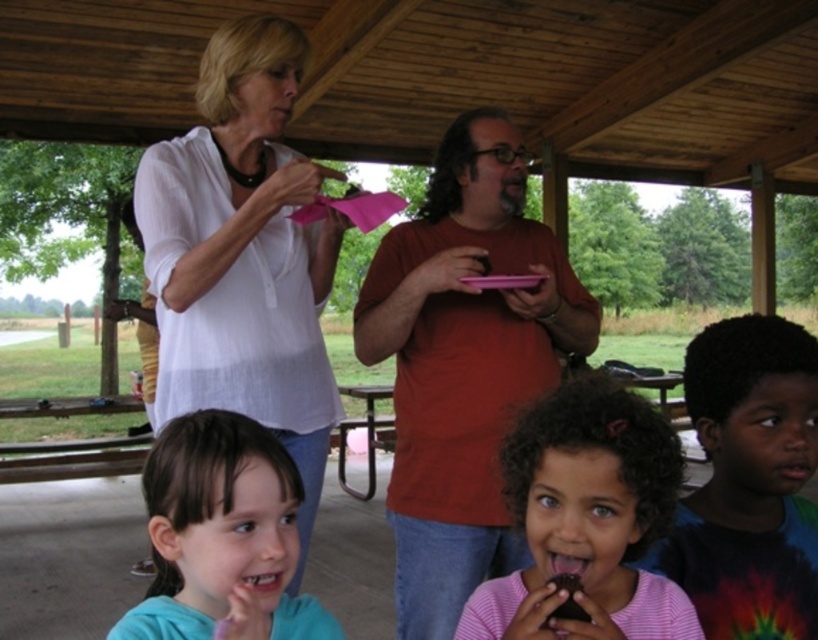
Question: Where is matte red shirt at center located in relation to pink striped shirt at lower center in the image?

Choices:
 (A) left
 (B) right

Answer: (A)

Question: From the image, what is the correct spatial relationship of white matte shirt at upper left in relation to pink striped shirt at lower center?

Choices:
 (A) above
 (B) below

Answer: (A)

Question: Can you confirm if dark blue tie-dye shirt at lower right is smaller than pink striped shirt at lower center?

Choices:
 (A) no
 (B) yes

Answer: (A)

Question: Which object is positioned farthest from the dark blue tie-dye shirt at lower right?

Choices:
 (A) pink striped shirt at lower center
 (B) matte red shirt at center
 (C) smooth teal shirt at lower left

Answer: (B)

Question: Which point is farther to the camera?

Choices:
 (A) (637, 512)
 (B) (142, 572)
 (C) (672, 577)
 (D) (524, 262)

Answer: (B)

Question: Estimate the real-world distances between objects in this image. Which object is closer to the smooth teal shirt at lower left?

Choices:
 (A) white matte shirt at upper left
 (B) dark blue tie-dye shirt at lower right

Answer: (B)